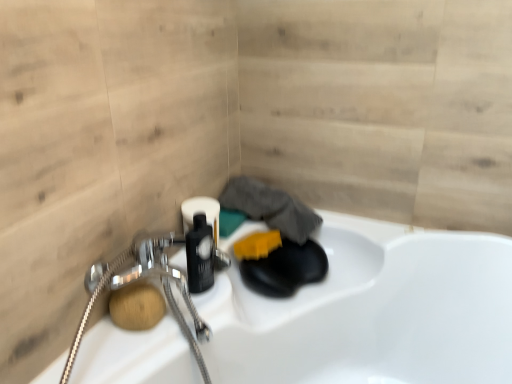
Question: Does natural wood soap at lower left, the 1th soap in the left-to-right sequence, turn towards yellow sponge at center, the 1th soap positioned from the back?

Choices:
 (A) yes
 (B) no

Answer: (B)

Question: Is natural wood soap at lower left, which is the 2th soap from right to left, turned away from yellow sponge at center, placed as the first soap when sorted from top to bottom?

Choices:
 (A) no
 (B) yes

Answer: (A)

Question: From a real-world perspective, does natural wood soap at lower left, which is the first soap in bottom-to-top order, stand above yellow sponge at center, the 1th soap positioned from the back?

Choices:
 (A) no
 (B) yes

Answer: (B)

Question: Is natural wood soap at lower left, the 1th soap in the left-to-right sequence, beside yellow sponge at center, placed as the first soap when sorted from right to left?

Choices:
 (A) yes
 (B) no

Answer: (B)

Question: Is natural wood soap at lower left, arranged as the second soap when viewed from the back, not near yellow sponge at center, placed as the first soap when sorted from right to left?

Choices:
 (A) yes
 (B) no

Answer: (B)

Question: From the image's perspective, does natural wood soap at lower left, the 1th soap in the left-to-right sequence, appear lower than yellow sponge at center, the second soap from the bottom?

Choices:
 (A) yes
 (B) no

Answer: (A)

Question: From a real-world perspective, is yellow sponge at center, the second soap from the bottom, on natural wood soap at lower left, arranged as the 2th soap when viewed from the top?

Choices:
 (A) no
 (B) yes

Answer: (A)

Question: Could you tell me if yellow sponge at center, which is the 2th soap in left-to-right order, is facing natural wood soap at lower left, which is the 2th soap from right to left?

Choices:
 (A) no
 (B) yes

Answer: (A)

Question: Is natural wood soap at lower left, which is the 2th soap from right to left, completely or partially inside yellow sponge at center, which is the 2th soap in left-to-right order?

Choices:
 (A) yes
 (B) no

Answer: (B)

Question: From the image's perspective, is yellow sponge at center, the second soap from the bottom, on natural wood soap at lower left, the 1th soap in the left-to-right sequence?

Choices:
 (A) no
 (B) yes

Answer: (B)

Question: Is yellow sponge at center, placed as the first soap when sorted from top to bottom, bigger than natural wood soap at lower left, which is the first soap in bottom-to-top order?

Choices:
 (A) yes
 (B) no

Answer: (A)

Question: Is yellow sponge at center, marked as the second soap in a front-to-back arrangement, outside natural wood soap at lower left, which is the first soap from front to back?

Choices:
 (A) yes
 (B) no

Answer: (A)

Question: From the image's perspective, is yellow sponge at center, the second soap from the bottom, positioned above or below natural wood soap at lower left, which is the first soap in bottom-to-top order?

Choices:
 (A) above
 (B) below

Answer: (A)